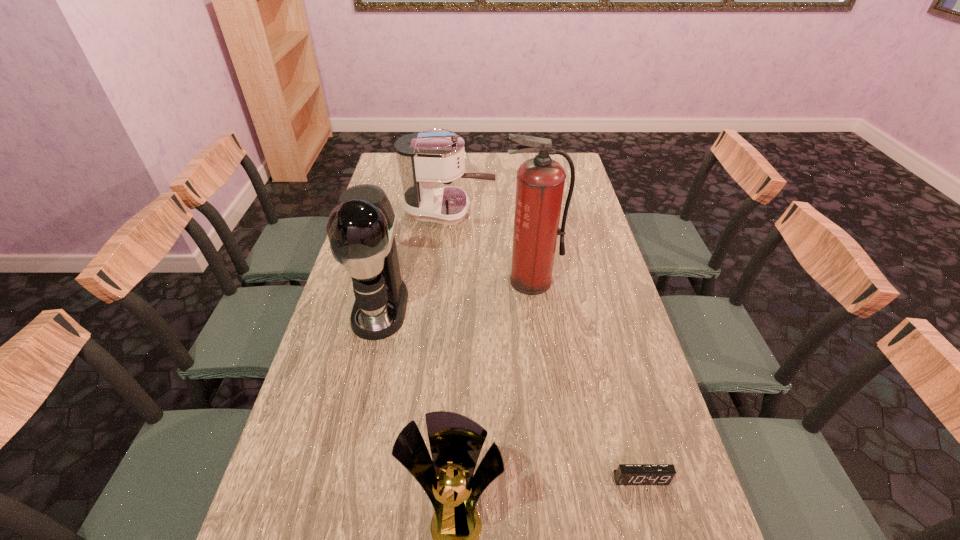
Locate an element on the screen. vacant area between the fire extinguisher and the shorter coffee maker is located at coordinates (491, 246).

The width and height of the screenshot is (960, 540). I want to click on free area in between the taller coffee maker and the shorter coffee maker, so click(415, 259).

Choose which object is the second nearest neighbor to the shortest object. Please provide its 2D coordinates. Your answer should be formatted as a tuple, i.e. [(x, y)], where the tuple contains the x and y coordinates of a point satisfying the conditions above.

[(540, 183)]

You are a GUI agent. You are given a task and a screenshot of the screen. Output one action in this format:
    pyautogui.click(x=<x>, y=<y>)
    Task: Click on the object that is the third closest one to the award
    Image resolution: width=960 pixels, height=540 pixels.
    Given the screenshot: What is the action you would take?
    pyautogui.click(x=540, y=183)

Locate an element on the screen. free space that satisfies the following two spatial constraints: 1. on the front-facing side of the farther coffee maker; 2. place cup under the spout of the taller coffee maker is located at coordinates pos(440,308).

The width and height of the screenshot is (960, 540). Identify the location of vacant space that satisfies the following two spatial constraints: 1. on the front-facing side of the farthest object; 2. place cup under the spout of the taller coffee maker. (440, 308).

Identify the location of vacant region that satisfies the following two spatial constraints: 1. on the front-facing side of the farthest object; 2. place cup under the spout of the nearer coffee maker. (440, 308).